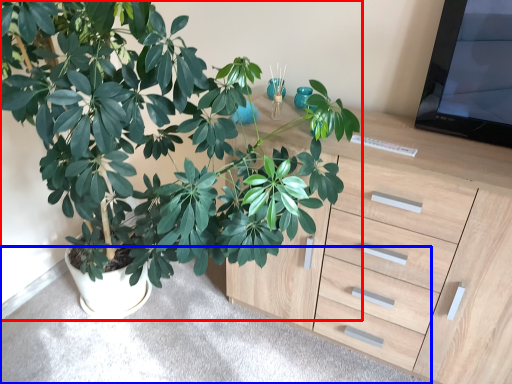
Question: Which object is closer to the camera taking this photo, houseplant (highlighted by a red box) or gray (highlighted by a blue box)?

Choices:
 (A) houseplant
 (B) gray

Answer: (A)